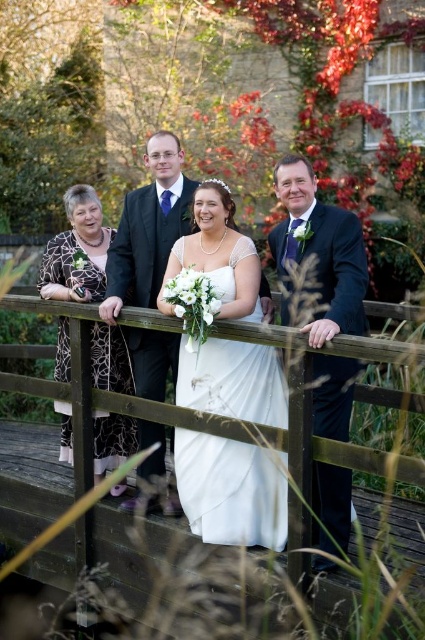
This screenshot has height=640, width=425. What do you see at coordinates (232, 490) in the screenshot?
I see `white satin dress at center` at bounding box center [232, 490].

Looking at this image, does white satin dress at center lie in front of matte black suit at center?

Yes, it is.

Does point (184, 448) come behind point (167, 227)?

No, (184, 448) is in front of (167, 227).

This screenshot has width=425, height=640. What are the coordinates of `white satin dress at center` in the screenshot? It's located at 232,490.

You are a GUI agent. You are given a task and a screenshot of the screen. Output one action in this format:
    pyautogui.click(x=<x>, y=<y>)
    Task: Click on the wooden at center
    
    Given the screenshot: What is the action you would take?
    pyautogui.click(x=195, y=410)

Is wooden at center to the left of printed silk dress at left from the viewer's perspective?

In fact, wooden at center is to the right of printed silk dress at left.

The image size is (425, 640). What do you see at coordinates (195, 410) in the screenshot?
I see `wooden at center` at bounding box center [195, 410].

I want to click on wooden at center, so click(195, 410).

Who is higher up, wooden at center or matte black suit at center?

matte black suit at center is higher up.

Can you confirm if wooden at center is positioned above matte black suit at center?

Actually, wooden at center is below matte black suit at center.

I want to click on wooden at center, so click(x=195, y=410).